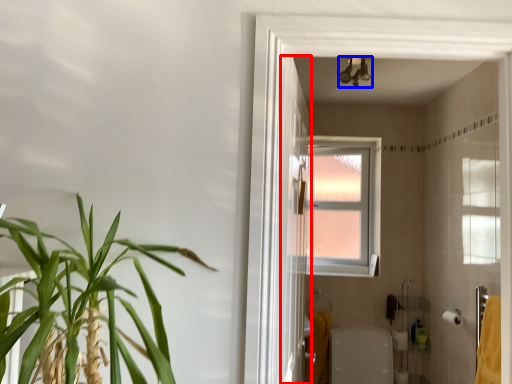
Question: Which of the following is the farthest to the observer, screen door (highlighted by a red box) or light fixture (highlighted by a blue box)?

Choices:
 (A) screen door
 (B) light fixture

Answer: (B)